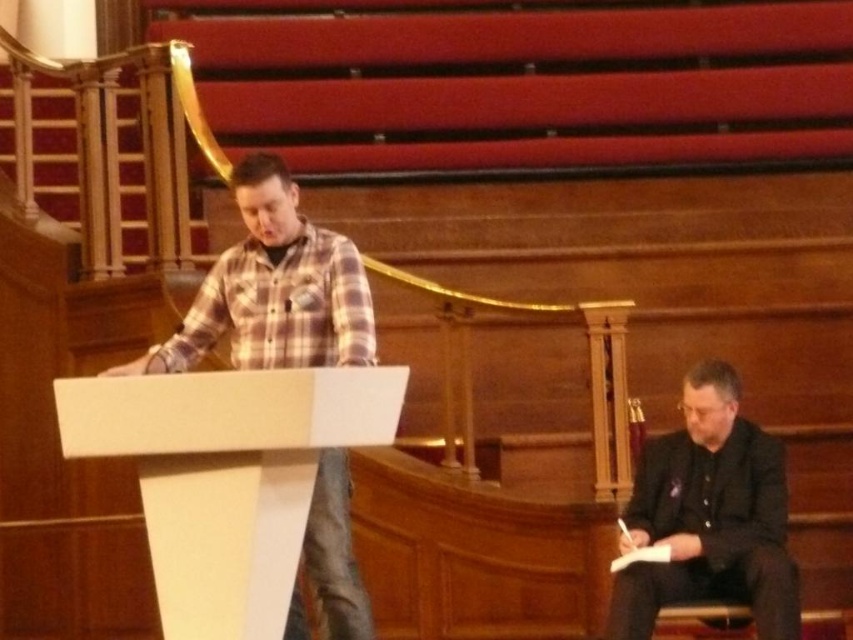
Between plaid flannel shirt at center and black matte suit at lower right, which one appears on the left side from the viewer's perspective?

plaid flannel shirt at center is more to the left.

What do you see at coordinates (273, 289) in the screenshot? The height and width of the screenshot is (640, 853). I see `plaid flannel shirt at center` at bounding box center [273, 289].

Identify the location of plaid flannel shirt at center. (273, 289).